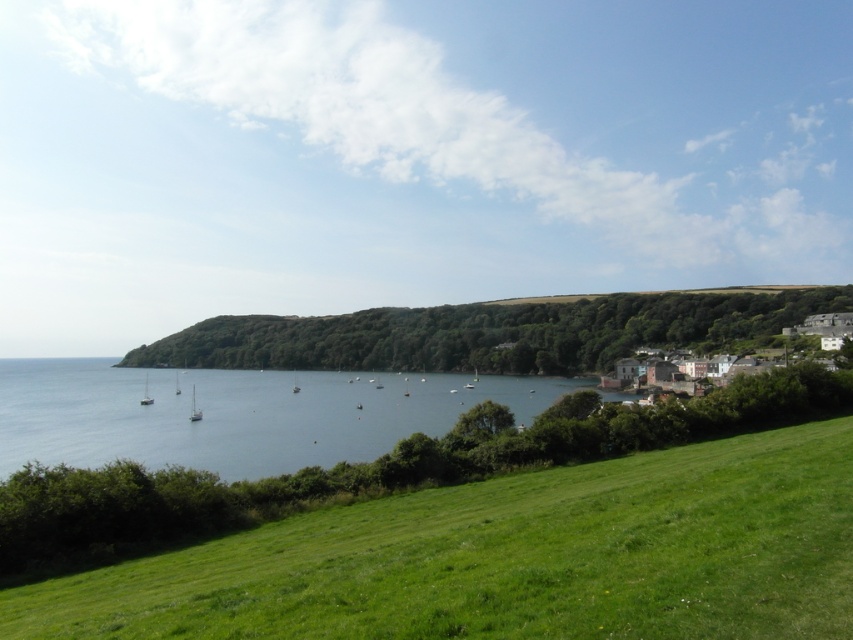
Question: Is green grassy field at lower left behind white glossy sailboat at center?

Choices:
 (A) yes
 (B) no

Answer: (B)

Question: Which is farther from the green leafy hillside at center?

Choices:
 (A) white glossy sailboat at center
 (B) green grassy field at lower left

Answer: (B)

Question: Which object appears farthest from the camera in this image?

Choices:
 (A) white matte sailboat at left
 (B) blue water at center

Answer: (A)

Question: Does green leafy hillside at center appear on the right side of white matte sailboat at left?

Choices:
 (A) yes
 (B) no

Answer: (A)

Question: Which point is closer to the camera?

Choices:
 (A) click(x=111, y=358)
 (B) click(x=144, y=401)
 (C) click(x=195, y=419)
 (D) click(x=535, y=554)

Answer: (D)

Question: Does green grassy field at lower left appear on the left side of white matte sailboat at left?

Choices:
 (A) no
 (B) yes

Answer: (A)